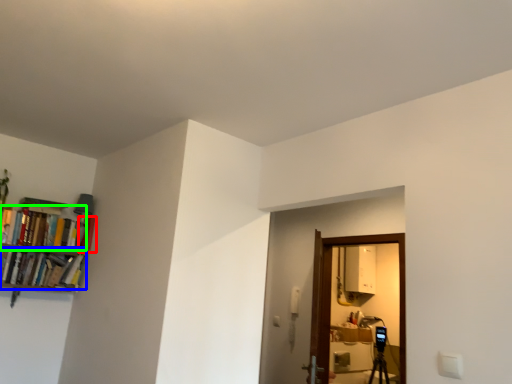
Question: Estimate the real-world distances between objects in this image. Which object is closer to book (highlighted by a red box), book (highlighted by a blue box) or book (highlighted by a green box)?

Choices:
 (A) book
 (B) book

Answer: (B)